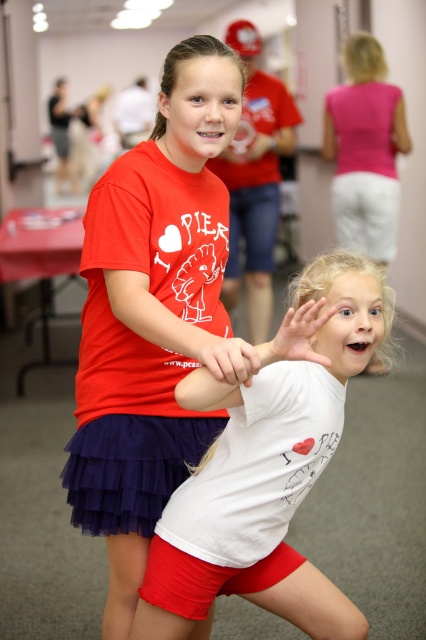
Question: Can you confirm if white matte t-shirt at center is positioned to the right of matte red tulle skirt at center?

Choices:
 (A) yes
 (B) no

Answer: (A)

Question: Is white matte t-shirt at center behind matte red tulle skirt at center?

Choices:
 (A) no
 (B) yes

Answer: (A)

Question: Which point is closer to the camera?

Choices:
 (A) (195, 461)
 (B) (259, 548)

Answer: (B)

Question: In this image, where is white matte t-shirt at center located relative to matte red tulle skirt at center?

Choices:
 (A) right
 (B) left

Answer: (A)